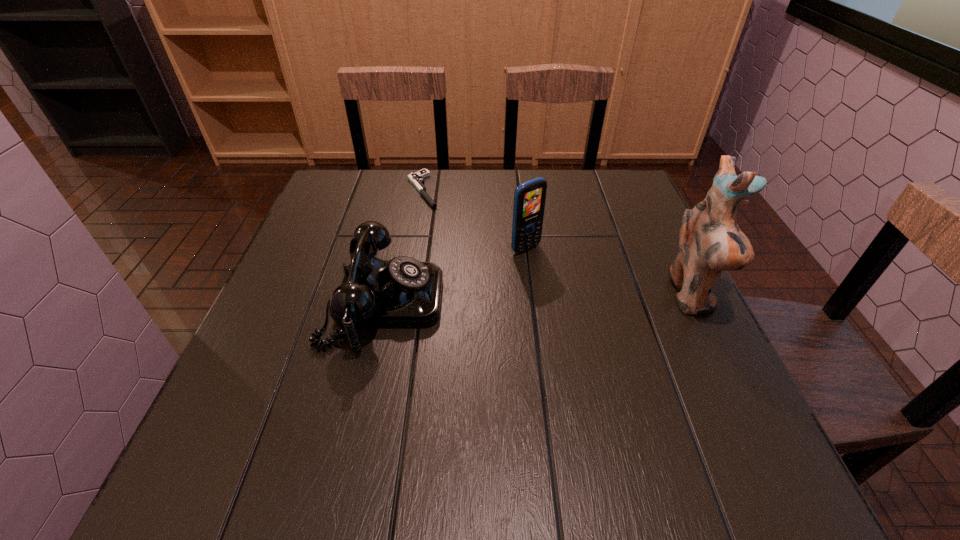
Locate an element on the screen. This screenshot has width=960, height=540. blank space at the right edge of the desktop is located at coordinates (656, 302).

Where is `vacant space at the far left corner`? This screenshot has width=960, height=540. vacant space at the far left corner is located at coordinates (354, 176).

The height and width of the screenshot is (540, 960). Identify the location of vacant space at the far right corner of the desktop. (613, 188).

In the image, there is a desktop. At what (x,y) coordinates should I click in order to perform the action: click on vacant space at the near right corner. Please return your answer as a coordinate pair (x, y). The height and width of the screenshot is (540, 960). Looking at the image, I should click on (654, 426).

Locate an element on the screen. free spot between the rightmost object and the second shortest object is located at coordinates (538, 299).

Locate an element on the screen. The image size is (960, 540). free space between the third shortest object and the farthest object is located at coordinates (474, 219).

Find the location of a particular element. The image size is (960, 540). vacant area between the third tallest object and the tallest object is located at coordinates (538, 299).

Image resolution: width=960 pixels, height=540 pixels. What are the coordinates of `unoccupied area between the telephone and the cellular telephone` in the screenshot? It's located at (455, 275).

This screenshot has width=960, height=540. Find the location of `free space between the shortest object and the telephone`. free space between the shortest object and the telephone is located at coordinates (403, 246).

The width and height of the screenshot is (960, 540). What are the coordinates of `free spot between the figurine and the shortest object` in the screenshot? It's located at [557, 243].